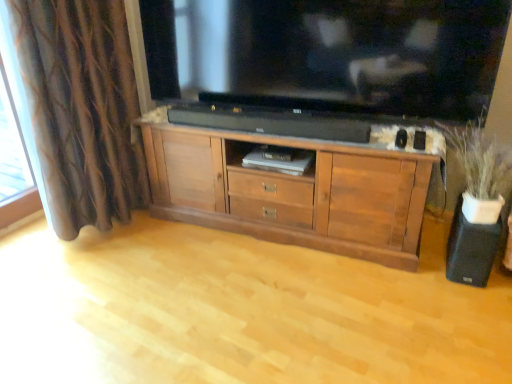
Question: Considering the positions of black glossy television at upper center and wooden cabinet at center in the image, is black glossy television at upper center bigger or smaller than wooden cabinet at center?

Choices:
 (A) small
 (B) big

Answer: (A)

Question: Relative to wooden cabinet at center, is black glossy television at upper center in front or behind?

Choices:
 (A) front
 (B) behind

Answer: (B)

Question: Which object is the closest to the black matte speaker at lower right?

Choices:
 (A) brown wood cabinet at center
 (B) white matte vase at right
 (C) brown textured curtain at left
 (D) wooden cabinet at center
 (E) black glossy television at upper center

Answer: (B)

Question: Which object is positioned farthest from the black glossy television at upper center?

Choices:
 (A) brown wood cabinet at center
 (B) wooden cabinet at center
 (C) white matte vase at right
 (D) brown textured curtain at left
 (E) black matte speaker at lower right

Answer: (B)